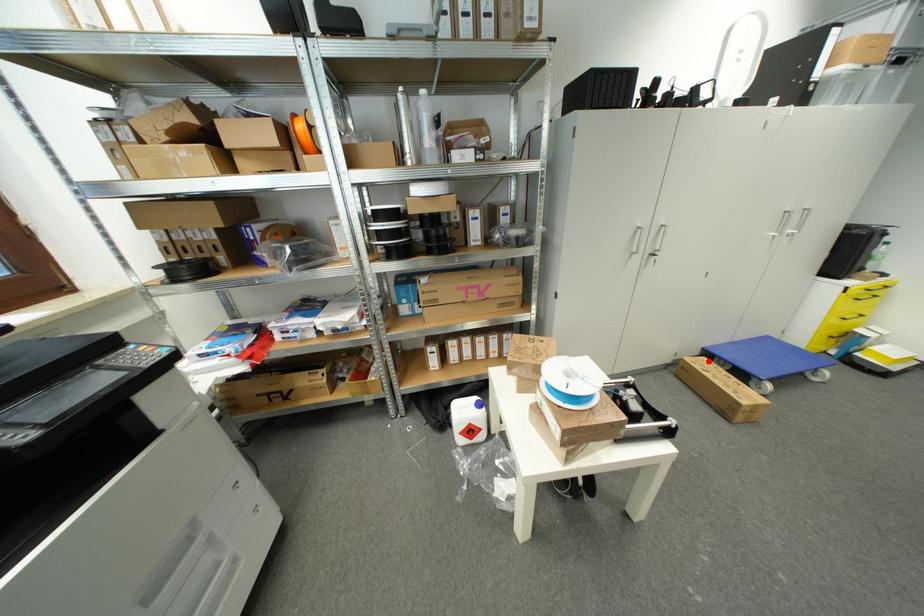
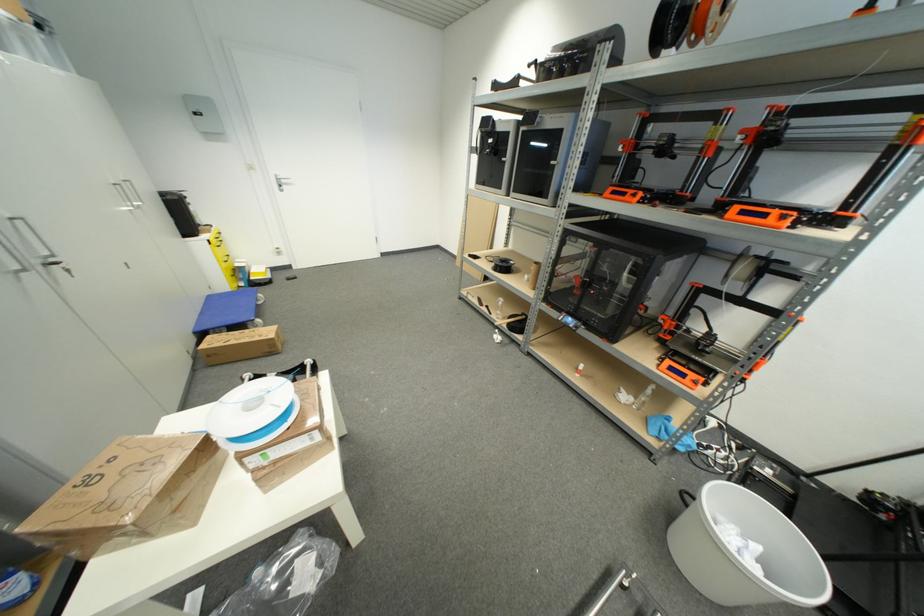
Question: I am providing you with two images of the same scene from different viewpoints. Image1 has a red point marked. In image2, the corresponding 3D location appears at what relative position? Reply with the corresponding letter.

Choices:
 (A) Closer
 (B) Farther

Answer: (B)